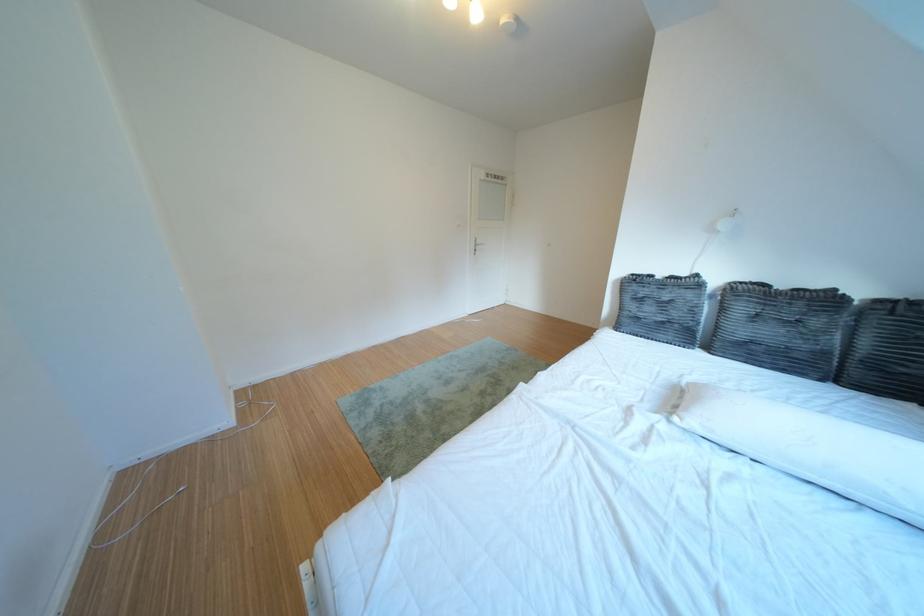
The width and height of the screenshot is (924, 616). What are the coordinates of `silver door handle` in the screenshot? It's located at (476, 245).